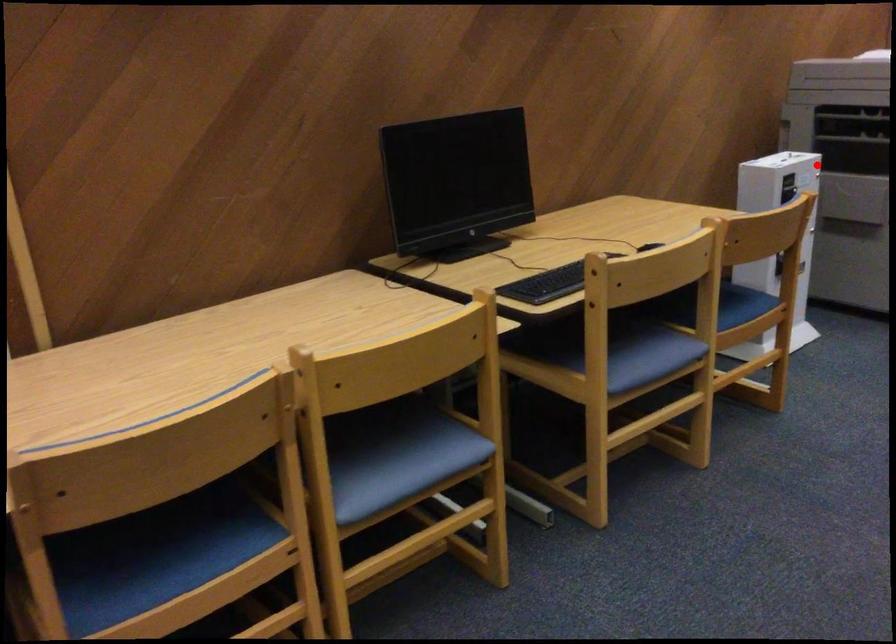
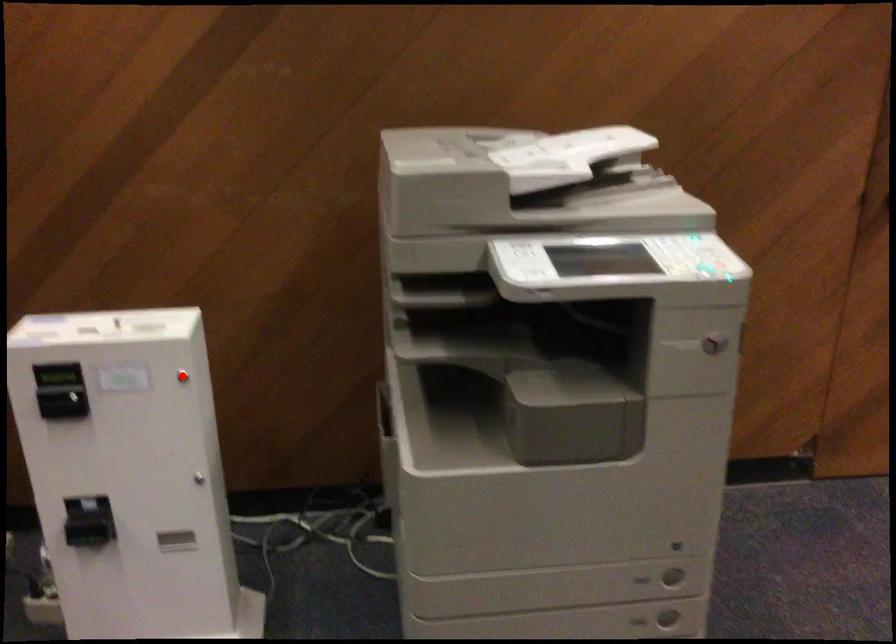
I am providing you with two images of the same scene from different viewpoints. A red point is marked on the first image and another point is marked on the second image. Do the highlighted points in image1 and image2 indicate the same real-world spot?

Yes